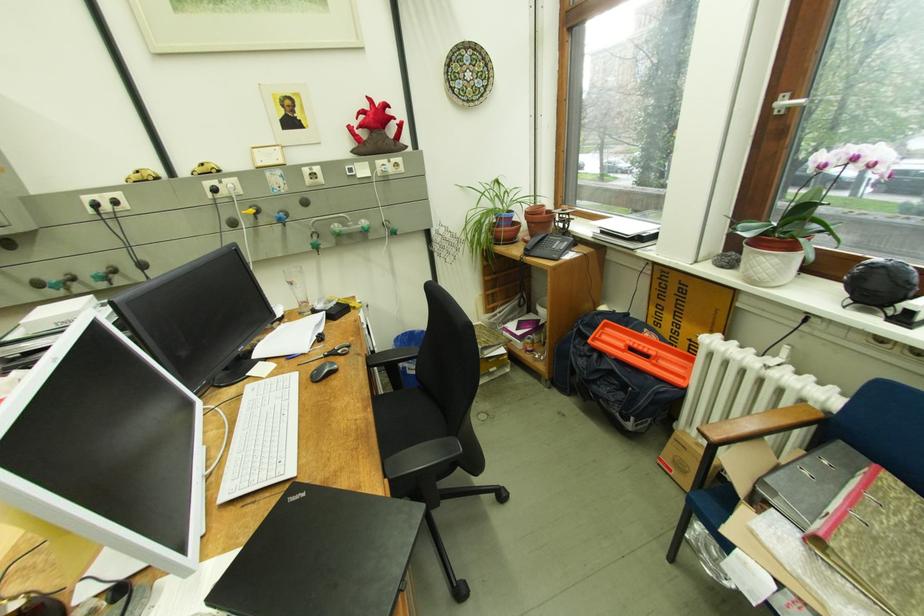
You are a GUI agent. You are given a task and a screenshot of the screen. Output one action in this format:
    pyautogui.click(x=<x>, y=<y>)
    Task: Click on the gray binder
    The height and width of the screenshot is (616, 924).
    Given the screenshot: What is the action you would take?
    pyautogui.click(x=810, y=482)